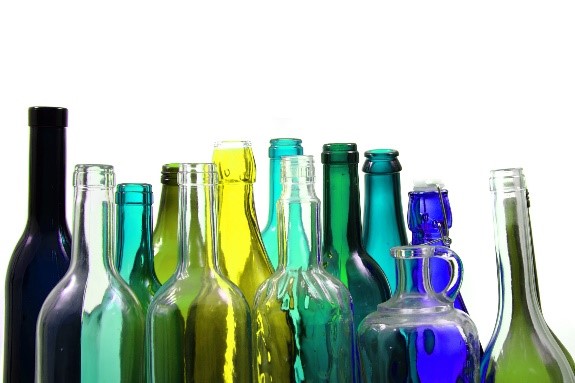
Where is `clear wine beakers`? The width and height of the screenshot is (575, 383). clear wine beakers is located at coordinates (85, 325), (194, 322), (283, 322), (400, 322), (516, 180).